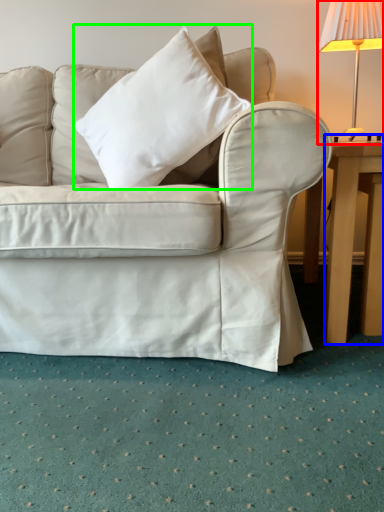
Question: Which object is positioned closest to lamp (highlighted by a red box)? Select from table (highlighted by a blue box) and pillow (highlighted by a green box).

Choices:
 (A) table
 (B) pillow

Answer: (A)